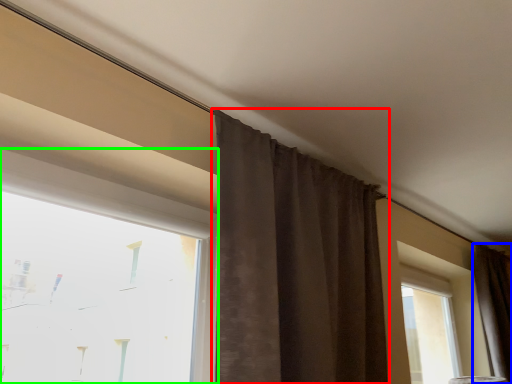
Question: Which object is positioned farthest from curtain (highlighted by a red box)? Select from curtain (highlighted by a blue box) and window (highlighted by a green box).

Choices:
 (A) curtain
 (B) window

Answer: (A)